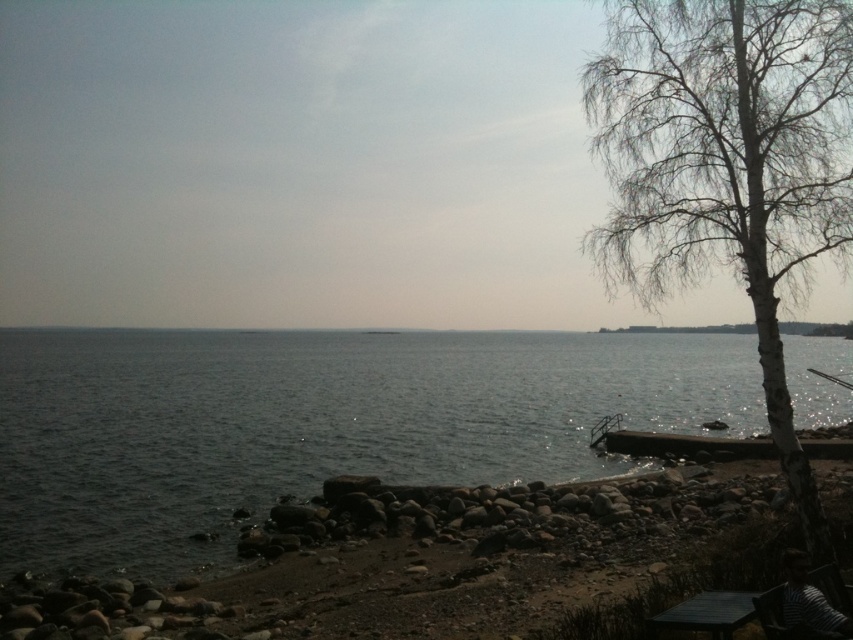
You are standing at the shoreline and want to walk to the white bark tree at right. Which direction should you move to get closer to the tree without stepping into the dark gray water at center?

To avoid the dark gray water at center, you should move to the right along the shoreline towards the white bark tree at right, as the water is between you and the tree but positioned closer to the viewer. The tree is further away, so moving right along the shore would keep you on solid ground.

You are a painter setting up your easel to capture the lakeside scene. You want to ensure that the white bark tree at right is visible in the painting without being blocked by the dark gray water at center. Based on their widths, can you position your easel such that the tree remains fully visible?

The dark gray water at center is wider than the white bark tree at right. Position your easel to the right side of the scene so that the tree at right is positioned to the far right edge of your canvas, ensuring the wider water at center does not obscure it.

You are a photographer planning to capture the reflection of the white bark tree at right in the dark gray water at center. Based on the scene, will the reflection be visible?

The dark gray water at center is shorter than the white bark tree at right, so the reflection of the white bark tree at right may not be fully visible in the dark gray water at center due to the water being lower in height compared to the tree.